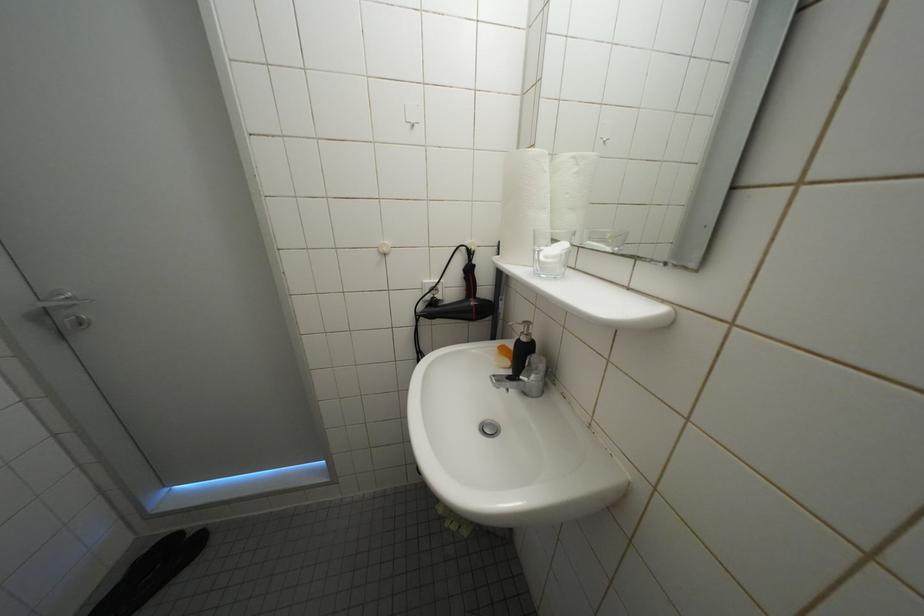
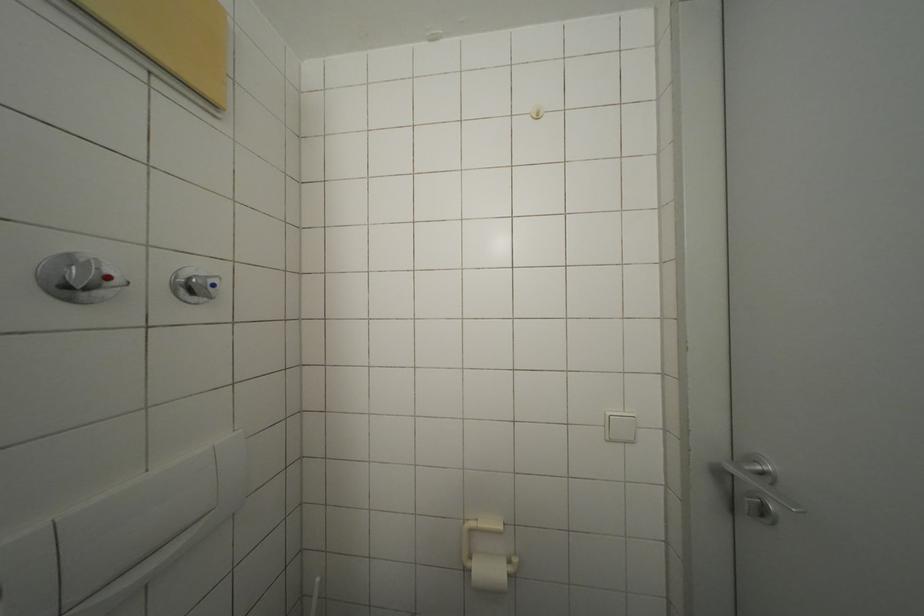
Question: The images are taken continuously from a first-person perspective. In which direction is your viewpoint rotating?

Choices:
 (A) Left
 (B) Right
 (C) Up
 (D) Down

Answer: (A)